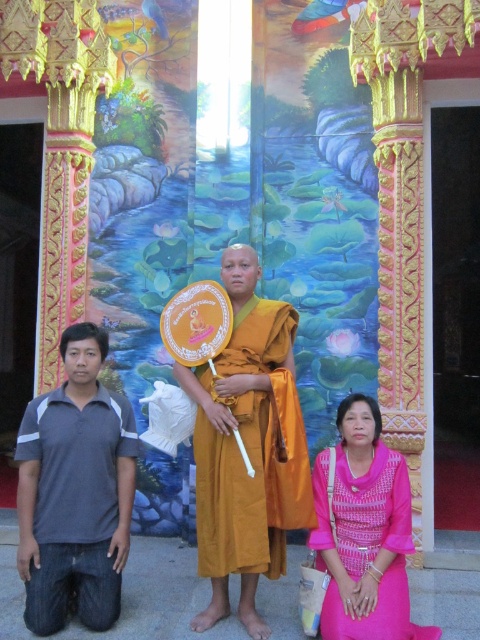
Is orange silk robe at center in front of pink woven fabric at center?

No, orange silk robe at center is further to the viewer.

In the scene shown: Can you confirm if orange silk robe at center is positioned to the right of pink woven fabric at center?

Incorrect, orange silk robe at center is not on the right side of pink woven fabric at center.

Between point (216, 509) and point (394, 554), which one is positioned behind?

Positioned behind is point (216, 509).

Locate an element on the screen. This screenshot has width=480, height=640. orange silk robe at center is located at coordinates (253, 454).

Is point (63, 458) more distant than point (346, 561)?

That is True.

Is point (84, 577) in front of point (343, 410)?

Yes, point (84, 577) is closer to viewer.

Where is `gray cotton polo shirt at lower left`? Image resolution: width=480 pixels, height=640 pixels. gray cotton polo shirt at lower left is located at coordinates (74, 492).

Does gray cotton polo shirt at lower left appear over orange silk robe at center?

Actually, gray cotton polo shirt at lower left is below orange silk robe at center.

Which is below, gray cotton polo shirt at lower left or orange silk robe at center?

Positioned lower is gray cotton polo shirt at lower left.

Measure the distance between gray cotton polo shirt at lower left and camera.

gray cotton polo shirt at lower left is 15.08 meters away from camera.

Image resolution: width=480 pixels, height=640 pixels. Find the location of `gray cotton polo shirt at lower left`. gray cotton polo shirt at lower left is located at coordinates (x=74, y=492).